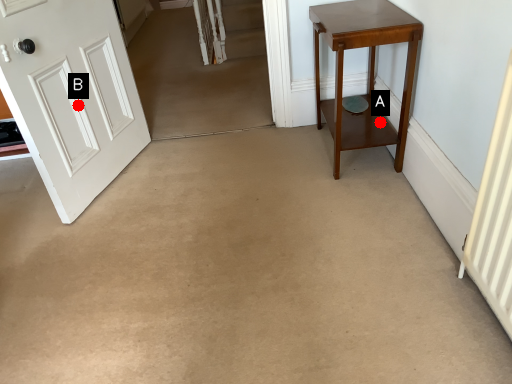
Question: Two points are circled on the image, labeled by A and B beside each circle. Which point is farther from the camera taking this photo?

Choices:
 (A) A is further
 (B) B is further

Answer: (A)